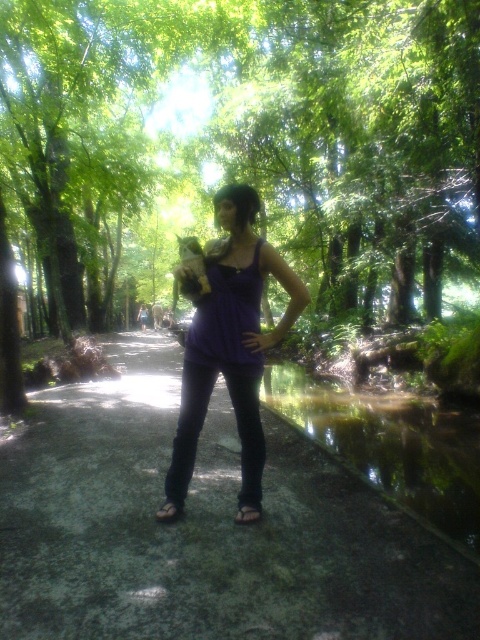
Between purple matte tank top at center and brown leather sandal at lower center, which one appears on the right side from the viewer's perspective?

Positioned to the right is purple matte tank top at center.

Can you confirm if purple matte tank top at center is bigger than brown leather sandal at lower center?

Indeed, purple matte tank top at center has a larger size compared to brown leather sandal at lower center.

Is point (206, 260) farther from viewer compared to point (167, 500)?

No.

Locate an element on the screen. The image size is (480, 640). purple matte tank top at center is located at coordinates (230, 340).

Is green concrete path at center thinner than brown leather sandal at lower center?

No.

Who is positioned more to the left, green concrete path at center or brown leather sandal at lower center?

brown leather sandal at lower center is more to the left.

The height and width of the screenshot is (640, 480). What do you see at coordinates (203, 529) in the screenshot? I see `green concrete path at center` at bounding box center [203, 529].

In order to click on green concrete path at center in this screenshot , I will do `click(203, 529)`.

Can you confirm if green concrete path at center is smaller than black leather sandal at lower center?

No, green concrete path at center is not smaller than black leather sandal at lower center.

Who is more distant from viewer, (59, 404) or (252, 506)?

The point (59, 404) is more distant.

Does point (282, 515) come farther from viewer compared to point (249, 513)?

Yes, it is.

Identify the location of green concrete path at center. The width and height of the screenshot is (480, 640). (203, 529).